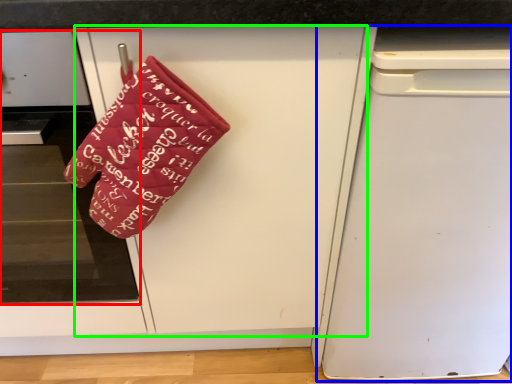
Question: Estimate the real-world distances between objects in this image. Which object is closer to home appliance (highlighted by a red box), dish washer (highlighted by a blue box) or door (highlighted by a green box)?

Choices:
 (A) dish washer
 (B) door

Answer: (B)